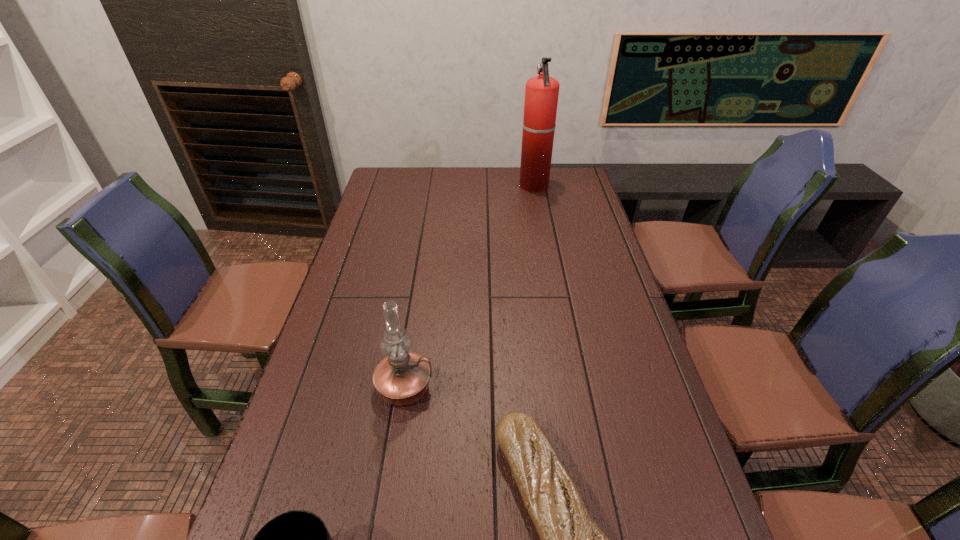
Identify the location of object at the far right corner. (541, 92).

The image size is (960, 540). Find the location of `vacant space at the far edge of the desktop`. vacant space at the far edge of the desktop is located at coordinates (420, 186).

You are a GUI agent. You are given a task and a screenshot of the screen. Output one action in this format:
    pyautogui.click(x=<x>, y=<y>)
    Task: Click on the vacant space at the left edge of the desktop
    The image size is (960, 540).
    Given the screenshot: What is the action you would take?
    pyautogui.click(x=391, y=197)

The height and width of the screenshot is (540, 960). In the image, there is a desktop. In order to click on blank space at the right edge in this screenshot , I will do [686, 516].

In order to click on free region at the far right corner in this screenshot , I will do `click(563, 179)`.

Locate an element on the screen. The height and width of the screenshot is (540, 960). free point between the second tallest object and the farthest object is located at coordinates (469, 287).

Where is `object that stands as the second closest to the baguet`? The width and height of the screenshot is (960, 540). object that stands as the second closest to the baguet is located at coordinates (298, 539).

Select which object appears as the closest to the shortest object. Please provide its 2D coordinates. Your answer should be formatted as a tuple, i.e. [(x, y)], where the tuple contains the x and y coordinates of a point satisfying the conditions above.

[(402, 378)]